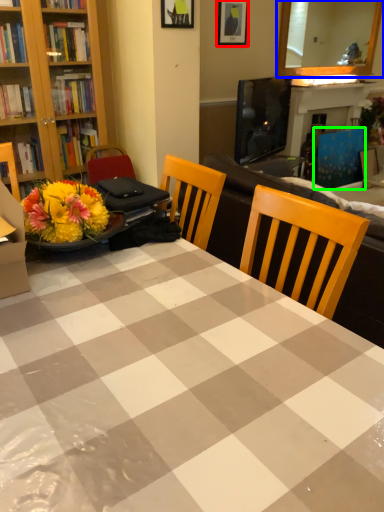
Question: Which object is the farthest from picture frame (highlighted by a red box)? Choose among these: mirror (highlighted by a blue box) or armchair (highlighted by a green box).

Choices:
 (A) mirror
 (B) armchair

Answer: (A)